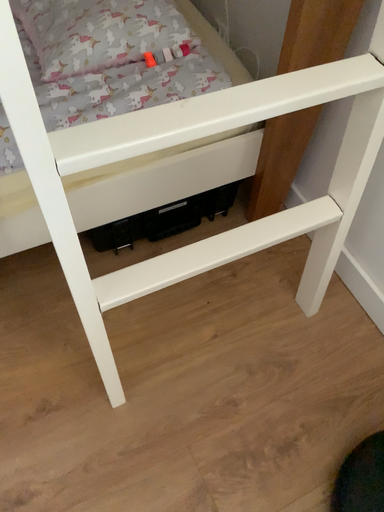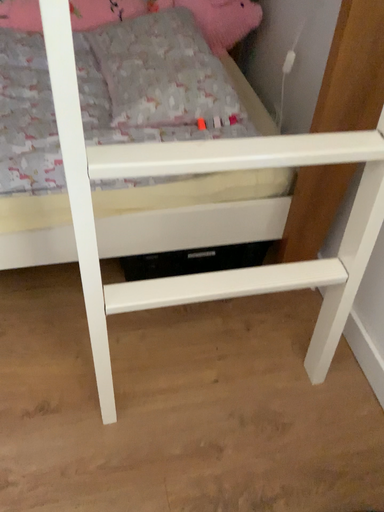
Question: How did the camera likely rotate when shooting the video?

Choices:
 (A) rotated upward
 (B) rotated downward

Answer: (A)